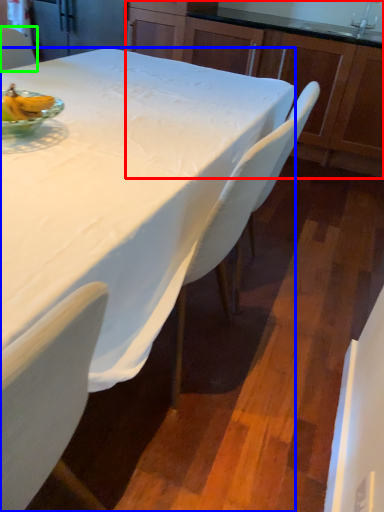
Question: Which is nearer to the cabinetry (highlighted by a red box)? desk (highlighted by a blue box) or chair (highlighted by a green box).

Choices:
 (A) desk
 (B) chair

Answer: (B)